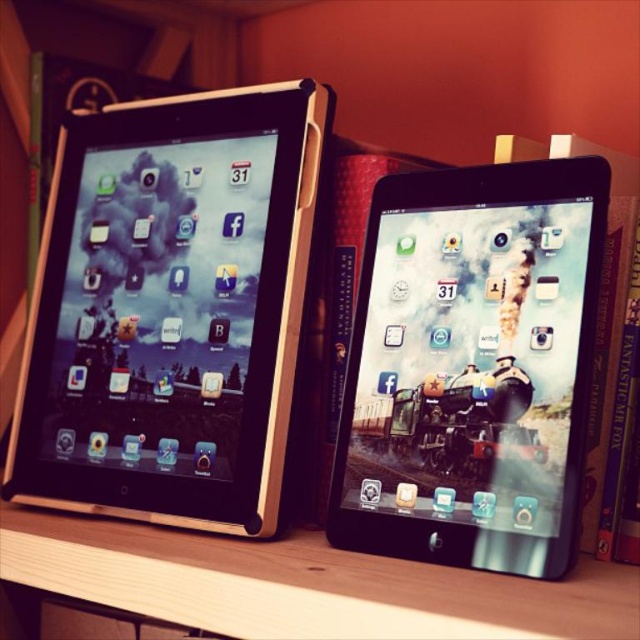
Question: Which point is closer to the camera?

Choices:
 (A) (61, 257)
 (B) (381, 285)

Answer: (B)

Question: Is matte black tablet at left closer to the viewer compared to satin black tablet at center?

Choices:
 (A) yes
 (B) no

Answer: (B)

Question: Is matte black tablet at left to the left of satin black tablet at center from the viewer's perspective?

Choices:
 (A) no
 (B) yes

Answer: (B)

Question: Is matte black tablet at left wider than satin black tablet at center?

Choices:
 (A) no
 (B) yes

Answer: (B)